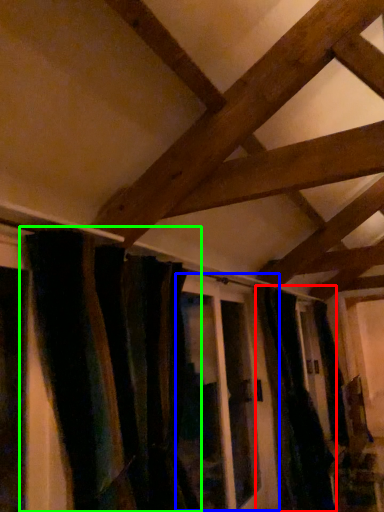
Question: Which is nearer to the curtain (highlighted by a red box)? screen door (highlighted by a blue box) or curtain (highlighted by a green box).

Choices:
 (A) screen door
 (B) curtain

Answer: (A)